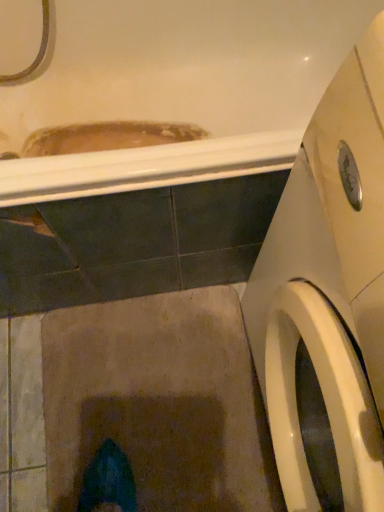
Question: Is point (316, 74) positioned closer to the camera than point (284, 432)?

Choices:
 (A) farther
 (B) closer

Answer: (A)

Question: In terms of height, does white glossy bathtub at upper center look taller or shorter compared to white glossy washing machine at right?

Choices:
 (A) tall
 (B) short

Answer: (B)

Question: In terms of width, does white glossy bathtub at upper center look wider or thinner when compared to white glossy washing machine at right?

Choices:
 (A) wide
 (B) thin

Answer: (A)

Question: Relative to white glossy bathtub at upper center, is white glossy washing machine at right in front or behind?

Choices:
 (A) front
 (B) behind

Answer: (A)

Question: Considering the relative positions of white glossy washing machine at right and white glossy bathtub at upper center in the image provided, is white glossy washing machine at right to the left or to the right of white glossy bathtub at upper center?

Choices:
 (A) left
 (B) right

Answer: (B)

Question: From the image's perspective, is white glossy washing machine at right positioned above or below white glossy bathtub at upper center?

Choices:
 (A) above
 (B) below

Answer: (B)

Question: Considering the positions of point (354, 470) and point (198, 177), is point (354, 470) closer or farther from the camera than point (198, 177)?

Choices:
 (A) closer
 (B) farther

Answer: (A)